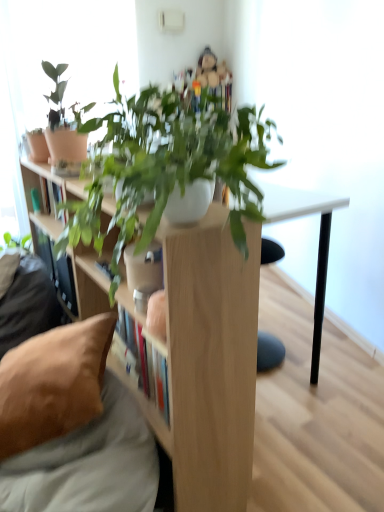
Question: Is matte clay pot at upper left further to camera compared to wooden bookshelf at left, the second shelf viewed from the right?

Choices:
 (A) yes
 (B) no

Answer: (B)

Question: Is wooden bookshelf at left, which appears as the 1th shelf when viewed from the left, located within matte clay pot at upper left?

Choices:
 (A) yes
 (B) no

Answer: (B)

Question: From a real-world perspective, does matte clay pot at upper left stand above wooden bookshelf at left, the second shelf viewed from the right?

Choices:
 (A) yes
 (B) no

Answer: (A)

Question: From the image's perspective, is matte clay pot at upper left on wooden bookshelf at left, which appears as the 1th shelf when viewed from the left?

Choices:
 (A) no
 (B) yes

Answer: (B)

Question: Considering the relative sizes of matte clay pot at upper left and wooden bookshelf at left, the second shelf viewed from the right, in the image provided, is matte clay pot at upper left shorter than wooden bookshelf at left, the second shelf viewed from the right,?

Choices:
 (A) yes
 (B) no

Answer: (A)

Question: From a real-world perspective, is matte clay pot at upper left positioned under wooden bookshelf at left, which appears as the 1th shelf when viewed from the left, based on gravity?

Choices:
 (A) yes
 (B) no

Answer: (B)

Question: Considering the relative positions of matte clay pot at upper left and matte white flowerpot at upper left in the image provided, is matte clay pot at upper left to the right of matte white flowerpot at upper left from the viewer's perspective?

Choices:
 (A) no
 (B) yes

Answer: (B)

Question: From the image's perspective, is matte clay pot at upper left above matte white flowerpot at upper left?

Choices:
 (A) no
 (B) yes

Answer: (B)

Question: Is matte clay pot at upper left shorter than matte white flowerpot at upper left?

Choices:
 (A) yes
 (B) no

Answer: (B)

Question: Does matte clay pot at upper left have a smaller size compared to matte white flowerpot at upper left?

Choices:
 (A) no
 (B) yes

Answer: (A)

Question: Is matte clay pot at upper left facing towards matte white flowerpot at upper left?

Choices:
 (A) no
 (B) yes

Answer: (A)

Question: Does matte clay pot at upper left appear on the left side of matte white flowerpot at upper left?

Choices:
 (A) yes
 (B) no

Answer: (B)

Question: Considering the relative positions of brown fabric couch at lower left and brown fabric pillow at lower left in the image provided, is brown fabric couch at lower left to the right of brown fabric pillow at lower left from the viewer's perspective?

Choices:
 (A) yes
 (B) no

Answer: (A)